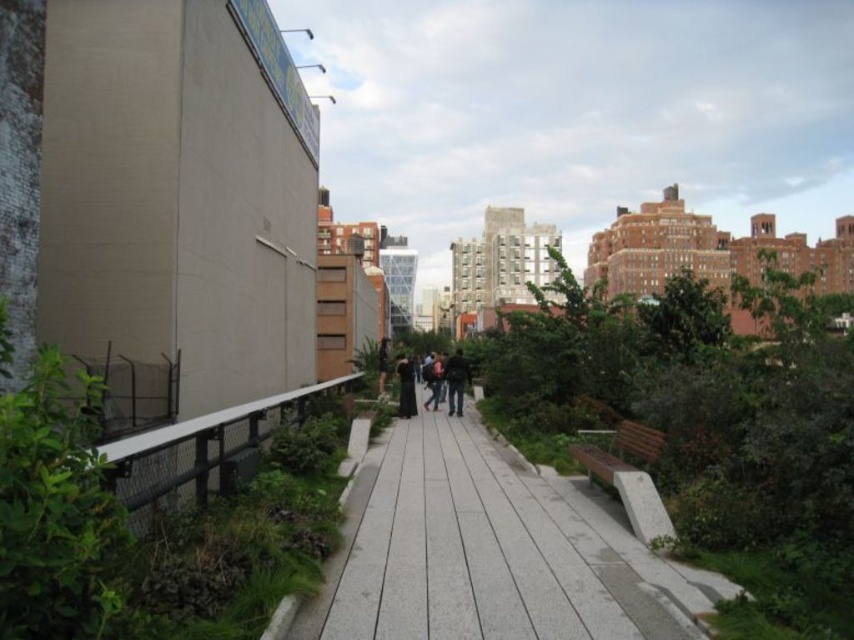
You are standing on the High Line park pathway and see both the dark gray jacket at center and the dark gray backpack at center lying on the ground. Which object takes up more space on the path?

The dark gray jacket at center is bigger than the dark gray backpack at center, so it takes up more space on the path.

You are standing on the High Line park pathway and want to walk towards the two points marked on the path. Which point, point (458, 397) or point (408, 387), is closer to you?

Point (458, 397) is closer to you because it is further to the viewer than point (408, 387).